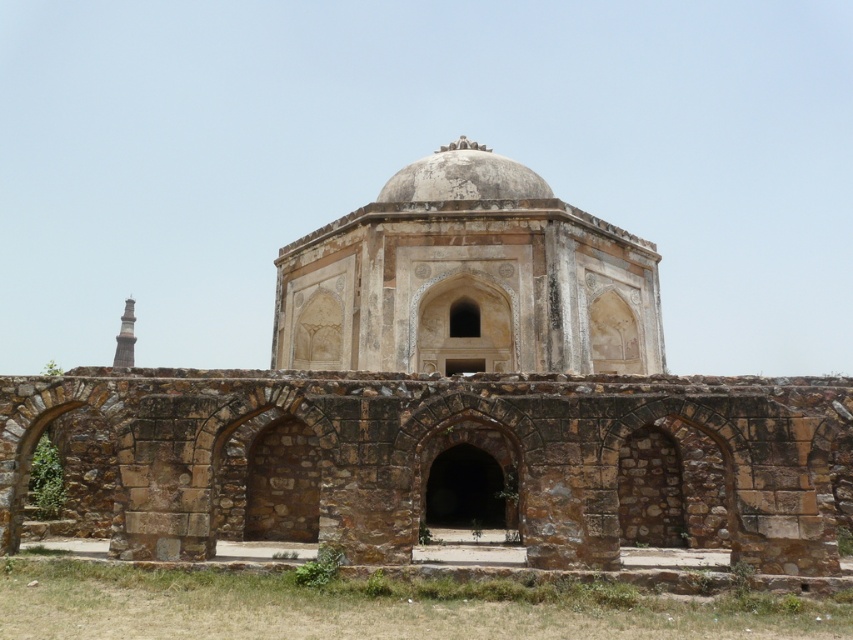
Locate an element on the screen. stone dome at center is located at coordinates (447, 410).

Who is lower down, stone dome at center or white stone dome at center?

stone dome at center is lower down.

Which is behind, point (450, 307) or point (392, 200)?

Point (392, 200)

You are a GUI agent. You are given a task and a screenshot of the screen. Output one action in this format:
    pyautogui.click(x=<x>, y=<y>)
    Task: Click on the stone dome at center
    The image size is (853, 640).
    Given the screenshot: What is the action you would take?
    pyautogui.click(x=447, y=410)